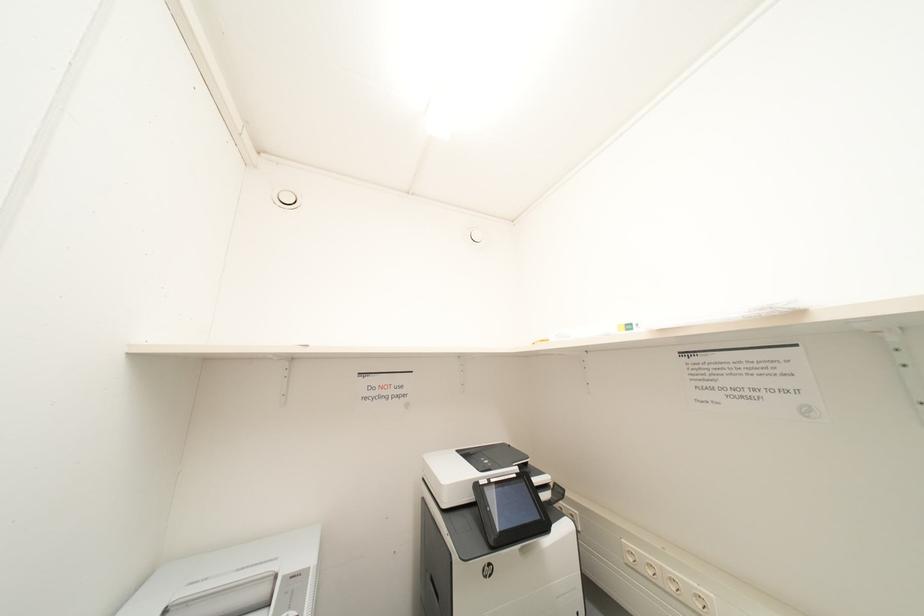
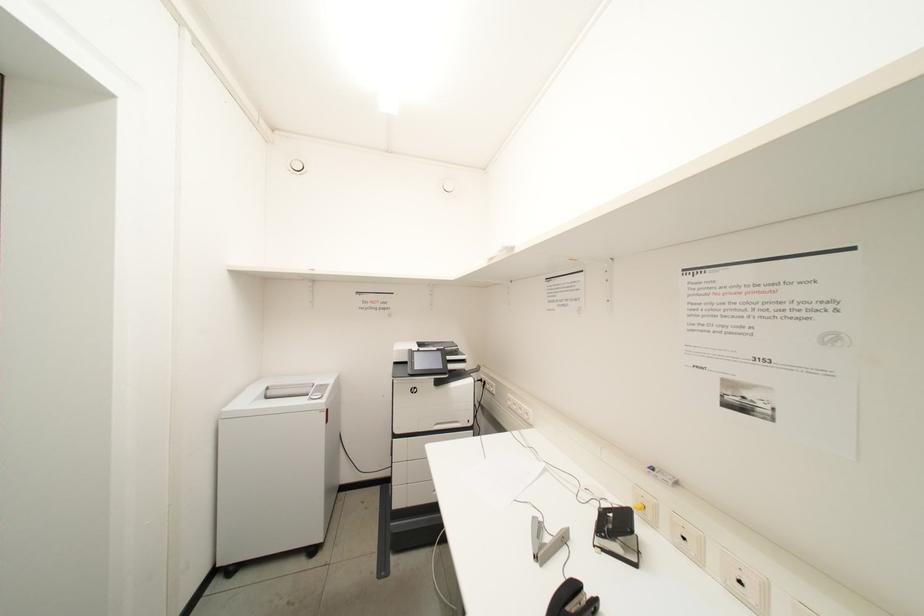
The images are taken continuously from a first-person perspective. In which direction are you moving?

The movement direction of the cameraman is right, backward.